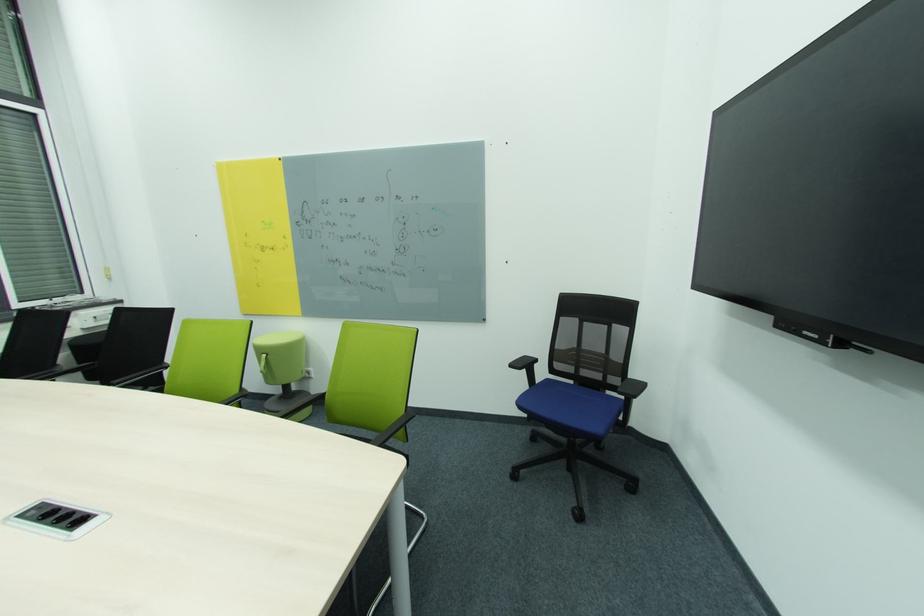
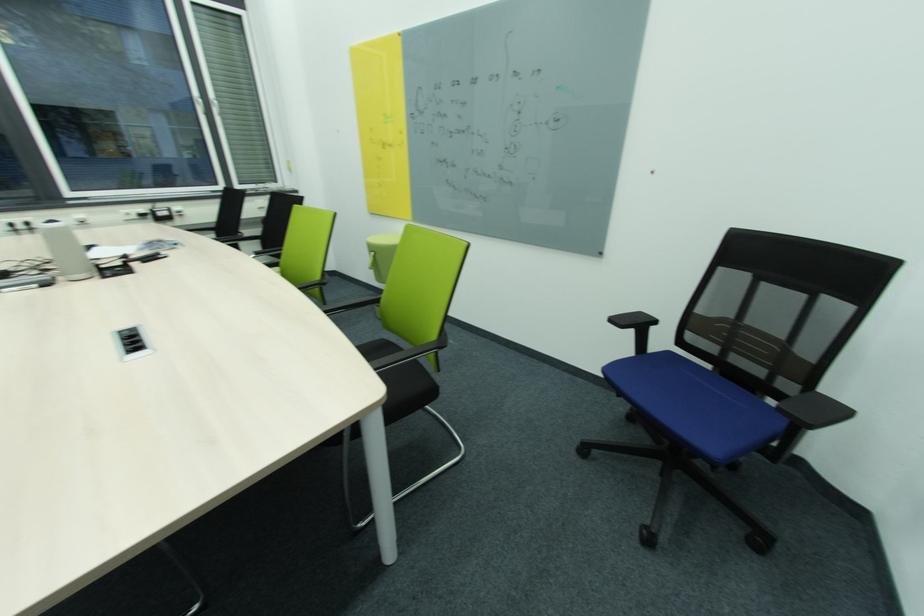
Locate, in the second image, the point that corresponds to [492,576] in the first image.

(503, 544)